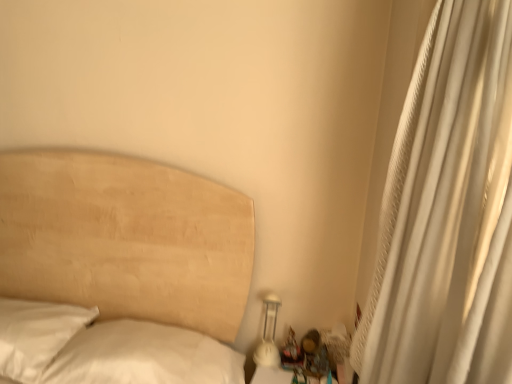
Question: Considering the positions of point (403, 114) and point (257, 349), is point (403, 114) closer or farther from the camera than point (257, 349)?

Choices:
 (A) closer
 (B) farther

Answer: (A)

Question: Is white textured curtain at right to the left or to the right of white glossy bedside lamp at lower right in the image?

Choices:
 (A) left
 (B) right

Answer: (B)

Question: Based on their relative distances, which object is farther from the white textured curtain at right?

Choices:
 (A) wooden figurine at lower right
 (B) white glossy bedside lamp at lower right

Answer: (B)

Question: Which object is the closest to the wooden figurine at lower right?

Choices:
 (A) white glossy bedside lamp at lower right
 (B) white textured curtain at right

Answer: (A)